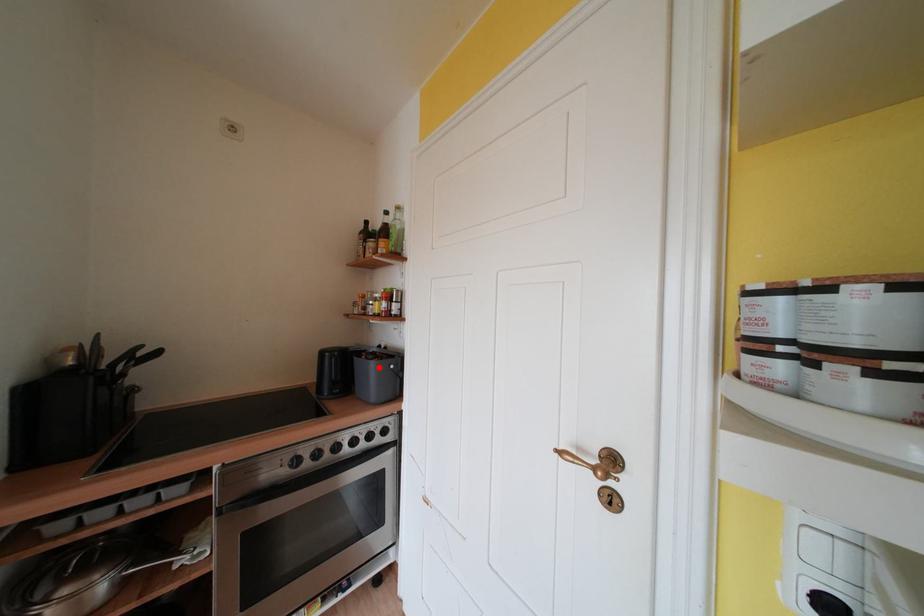
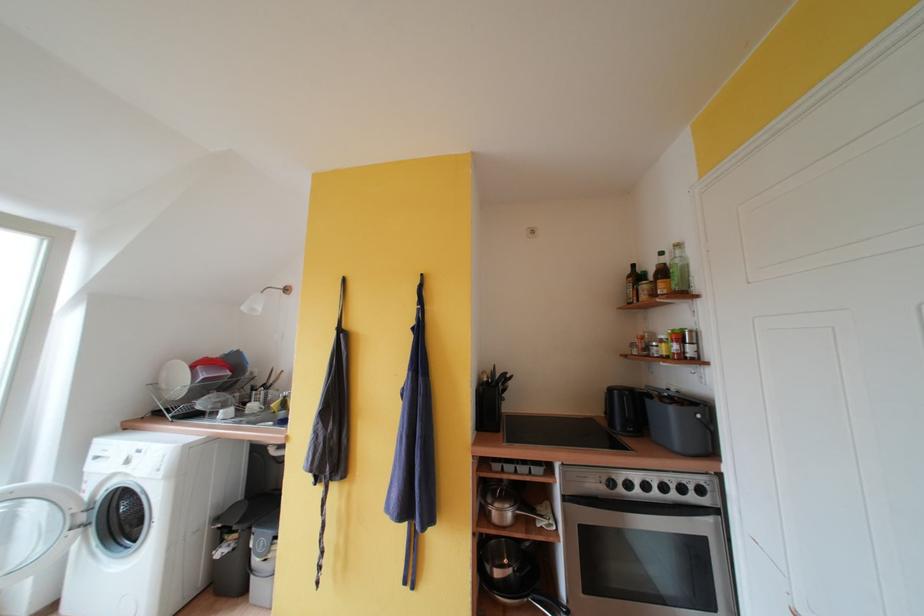
The point at the highlighted location is marked in the first image. Where is the corresponding point in the second image?

(678, 413)